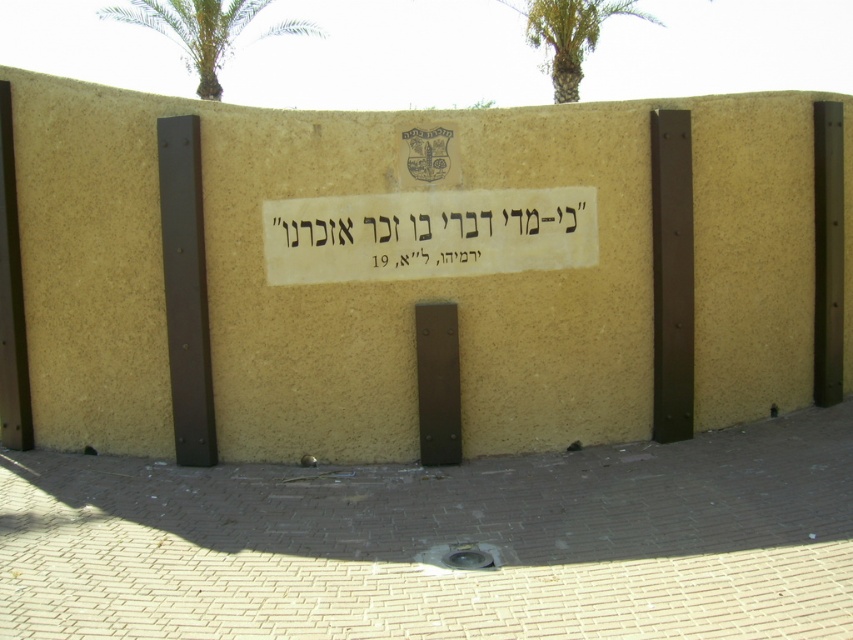
You are standing in front of the beige textured wall and want to place a new plaque to the right of the white paper sign at center. According to the scene description, where should you place the new plaque relative to the green leafy palm tree at upper center?

The white paper sign at center is to the left of the green leafy palm tree at upper center. To place the new plaque to the right of the white paper sign at center, it should be positioned between the white paper sign at center and the green leafy palm tree at upper center.

You are standing at the base of the wall and want to place a 10 meter long banner between the white paper sign at center and the green leafy palm tree at upper center. Will the banner fit without overlapping either object?

The distance between the white paper sign at center and the green leafy palm tree at upper center is 9.61 meters. Since the banner is 10 meters long, it will be 0.39 meters too long and will overlap both objects.

You are an artist trying to sketch the scene. You need to decide which object to draw first based on their widths. Which one should you focus on first, the white paper sign at center or the green leafy palm tree at upper left?

The white paper sign at center is thinner than the green leafy palm tree at upper left, so you should focus on drawing the white paper sign at center first since it is narrower and might be easier to sketch initially.